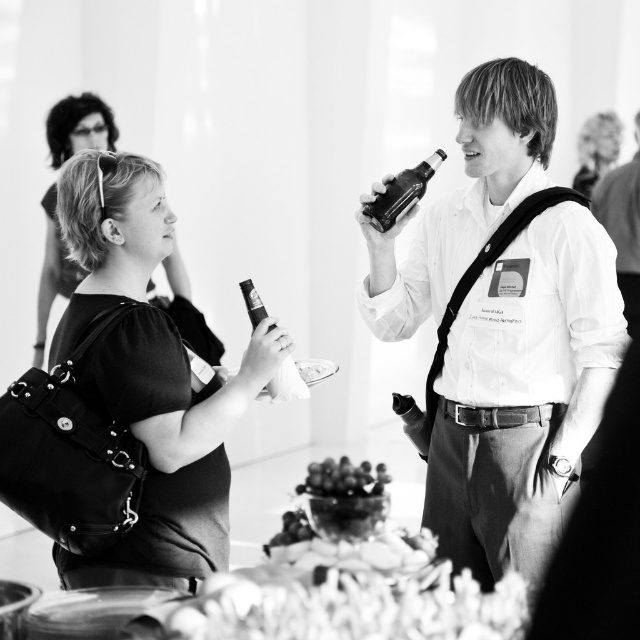
You are a bartender at a party and you need to place a smooth glass grapes at center and a matte glass bottle at center on a shelf. The shelf is 35 inches wide. Can both items fit side by side without overlapping?

The distance between the smooth glass grapes at center and the matte glass bottle at center is 36.04 inches. Since the shelf is only 35 inches wide, the items cannot fit side by side without overlapping.

You are organizing a backpacking trip and need to pack your essentials. You have a matte black bag at left and a shiny glass bottle at upper right. Which item has a greater capacity for carrying items?

The matte black bag at left has a greater capacity for carrying items since its width is larger than the shiny glass bottle at upper right.

What is located at the coordinates point (77, 125)?

The point (77, 125) is occupied by a matte black dress at center.